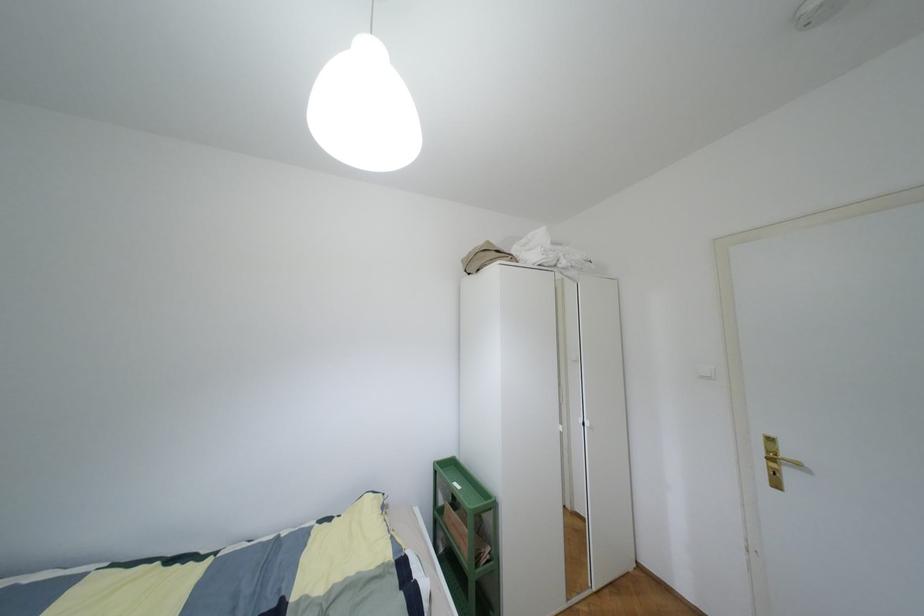
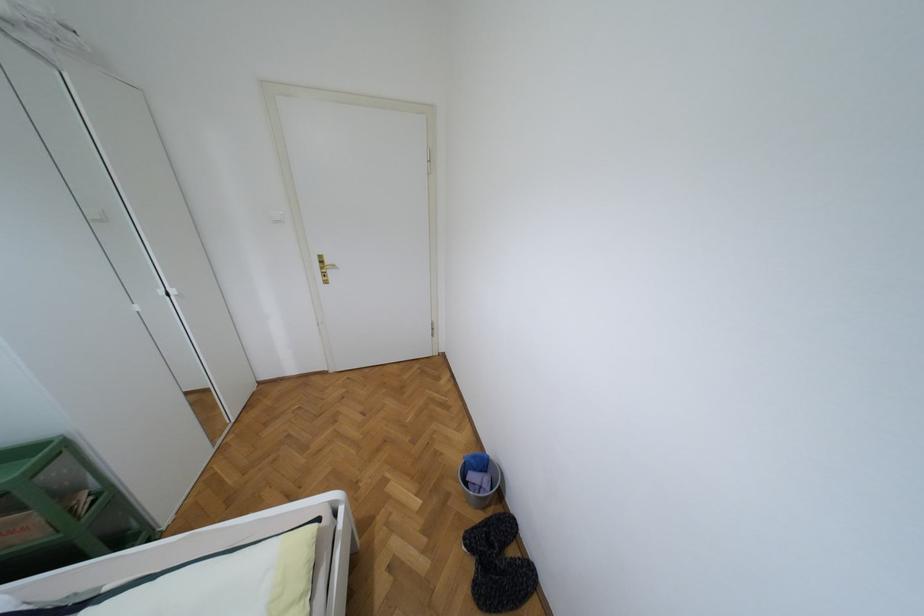
In the scene shown: The first image is from the beginning of the video and the second image is from the end. How did the camera likely rotate when shooting the video?

The rotation direction of the camera is right-down.